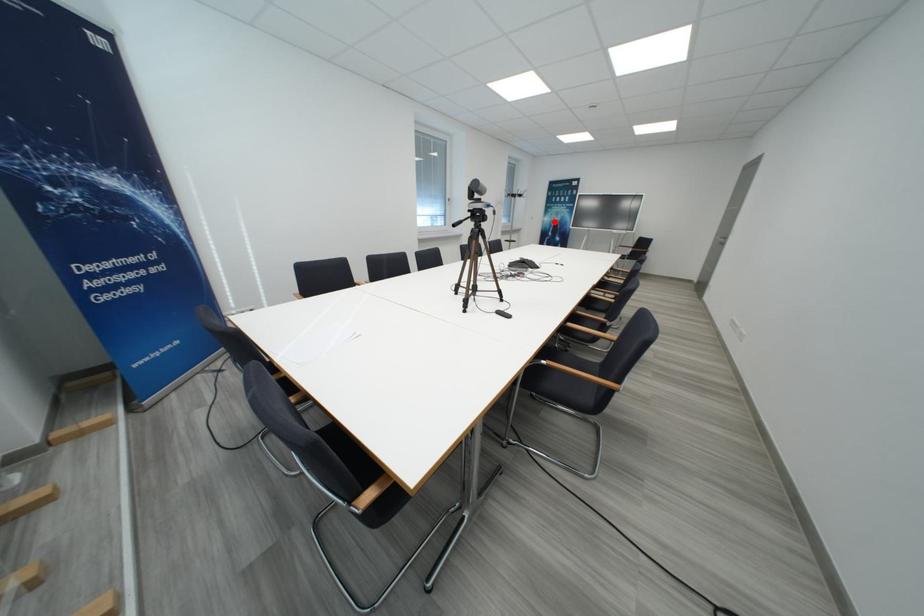
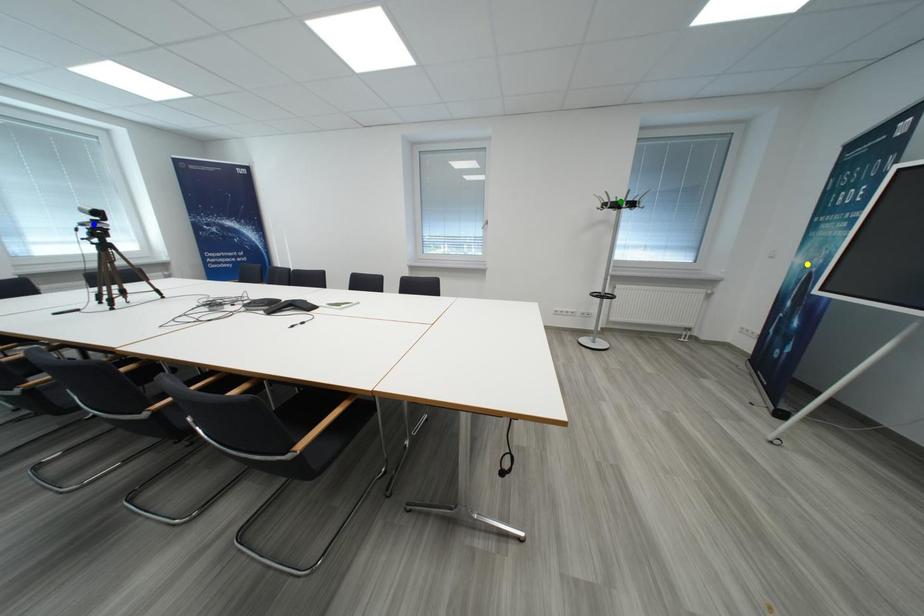
Question: I am providing you with two images of the same scene from different viewpoints. A red point is marked on the first image. You are given multiple points on the second image. In image 2, which mark is for the same physical point as the one in image 1?

Choices:
 (A) green point
 (B) blue point
 (C) yellow point

Answer: (C)